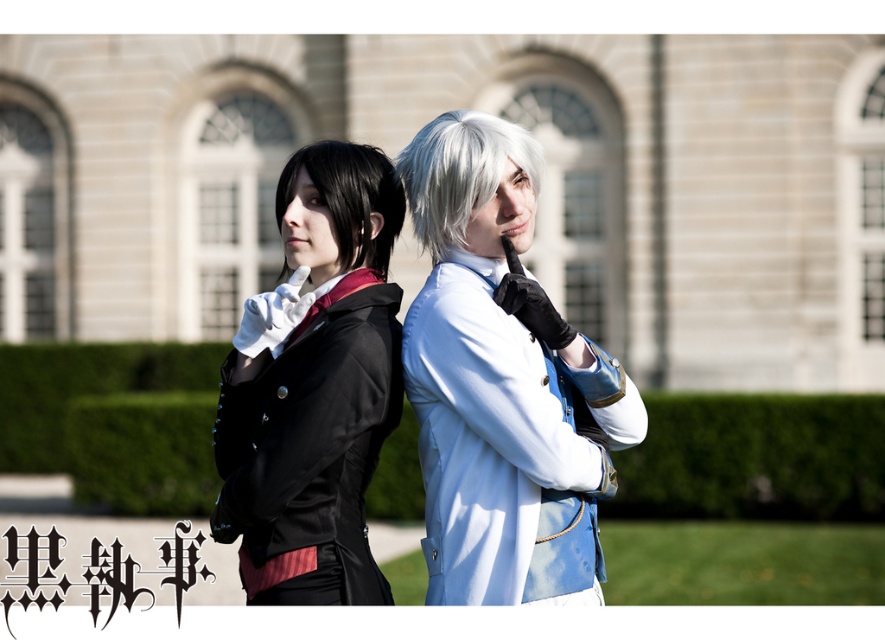
Question: Observing the image, what is the correct spatial positioning of matte black coat at left in reference to white silky hair at center?

Choices:
 (A) right
 (B) left

Answer: (B)

Question: Which of the following is the farthest from the observer?

Choices:
 (A) (472, 310)
 (B) (383, 170)
 (C) (462, 115)

Answer: (B)

Question: Can you confirm if satin white wig at center is positioned to the left of matte black coat at left?

Choices:
 (A) no
 (B) yes

Answer: (A)

Question: Does satin white wig at center have a greater width compared to white silky hair at center?

Choices:
 (A) yes
 (B) no

Answer: (A)

Question: Estimate the real-world distances between objects in this image. Which object is farther from the satin white wig at center?

Choices:
 (A) shiny black hair at left
 (B) matte black coat at left

Answer: (A)

Question: Which object is closer to the camera taking this photo?

Choices:
 (A) shiny black hair at left
 (B) satin white wig at center
 (C) matte black coat at left
 (D) white silky hair at center

Answer: (B)